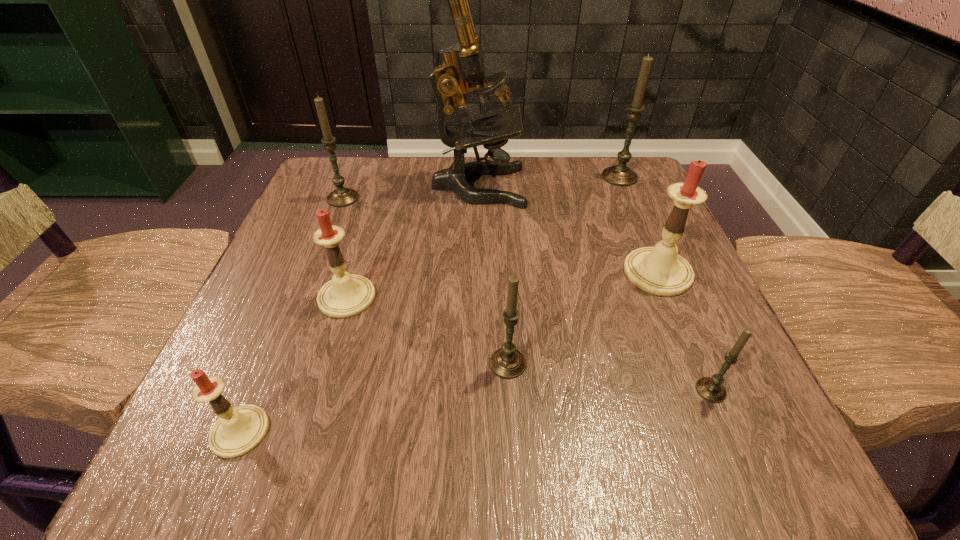
This screenshot has height=540, width=960. In order to click on the tallest object in this screenshot , I will do `click(462, 62)`.

I want to click on the second tallest object, so click(x=620, y=175).

At what (x,y) coordinates should I click in order to perform the action: click on the farthest gray candle. Please return your answer as a coordinate pair (x, y). This screenshot has width=960, height=540. Looking at the image, I should click on (620, 175).

Image resolution: width=960 pixels, height=540 pixels. I want to click on the third nearest gray candle, so click(x=340, y=197).

Locate an element on the screen. The image size is (960, 540). the leftmost gray candle is located at coordinates (340, 197).

You are a GUI agent. You are given a task and a screenshot of the screen. Output one action in this format:
    pyautogui.click(x=<x>, y=<y>)
    Task: Click on the biggest red candle
    The width and height of the screenshot is (960, 540).
    Given the screenshot: What is the action you would take?
    pyautogui.click(x=660, y=270)

Where is `the second smallest red candle`? The height and width of the screenshot is (540, 960). the second smallest red candle is located at coordinates (344, 296).

Image resolution: width=960 pixels, height=540 pixels. I want to click on the fourth candle from left to right, so click(507, 362).

Locate an element on the screen. This screenshot has width=960, height=540. the third gray candle from right to left is located at coordinates (507, 362).

Locate an element on the screen. The height and width of the screenshot is (540, 960). the smallest gray candle is located at coordinates (712, 389).